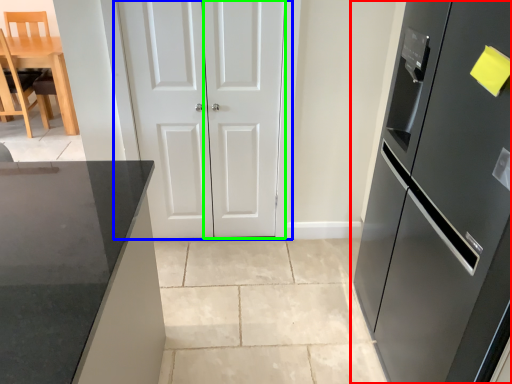
Question: Based on their relative distances, which object is farther from refrigerator (highlighted by a red box)? Choose from door (highlighted by a blue box) and door (highlighted by a green box).

Choices:
 (A) door
 (B) door

Answer: (A)